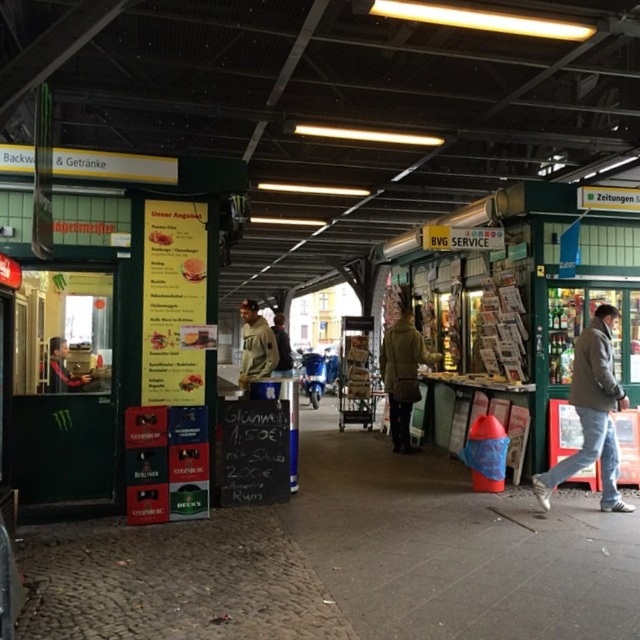
Does light brown leather jacket at lower right come in front of green wool coat at center?

Yes, it is.

Between point (609, 403) and point (404, 364), which one is positioned in front?

Positioned in front is point (609, 403).

Which is behind, point (604, 332) or point (410, 337)?

The point (410, 337) is behind.

Where is `light brown leather jacket at lower right`? This screenshot has width=640, height=640. light brown leather jacket at lower right is located at coordinates (592, 413).

Can you confirm if light brown leather jacket at lower right is thinner than khaki cotton jacket at center?

No.

Can you confirm if light brown leather jacket at lower right is positioned below khaki cotton jacket at center?

Correct, light brown leather jacket at lower right is located below khaki cotton jacket at center.

Identify the location of light brown leather jacket at lower right. (592, 413).

The width and height of the screenshot is (640, 640). In order to click on light brown leather jacket at lower right in this screenshot , I will do `click(592, 413)`.

Based on the photo, is light brown leather jacket at center below matte black jacket at left?

Correct, light brown leather jacket at center is located below matte black jacket at left.

Is light brown leather jacket at center further to the viewer compared to matte black jacket at left?

Yes.

Does point (253, 342) come closer to viewer compared to point (61, 348)?

No, it is not.

Identify the location of light brown leather jacket at center. This screenshot has height=640, width=640. (256, 346).